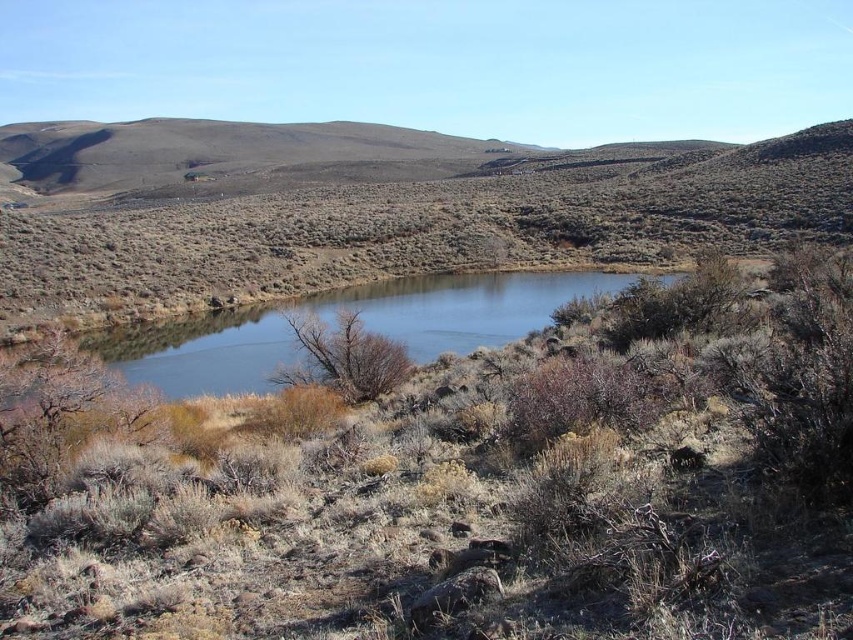
Who is shorter, dry grass at center or clear water at center?

dry grass at center is shorter.

Which is more to the right, dry grass at center or clear water at center?

clear water at center

Is point (444, 368) closer to viewer compared to point (264, 360)?

Yes, it is.

This screenshot has height=640, width=853. In order to click on dry grass at center in this screenshot , I will do `click(465, 486)`.

Locate an element on the screen. dry grass at center is located at coordinates (465, 486).

Is point (397, 451) farther from viewer compared to point (364, 193)?

No, (397, 451) is closer to viewer.

Find the location of `dry grass at center`. dry grass at center is located at coordinates (465, 486).

Is brown textured hillside at upper center bigger than clear water at center?

Indeed, brown textured hillside at upper center has a larger size compared to clear water at center.

Can you confirm if brown textured hillside at upper center is positioned above clear water at center?

Correct, brown textured hillside at upper center is located above clear water at center.

What are the coordinates of `brown textured hillside at upper center` in the screenshot? It's located at (424, 227).